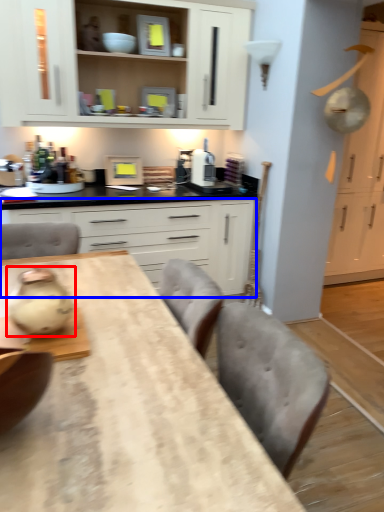
Question: Which point is further to the camera, tea pot (highlighted by a red box) or cabinetry (highlighted by a blue box)?

Choices:
 (A) tea pot
 (B) cabinetry

Answer: (B)